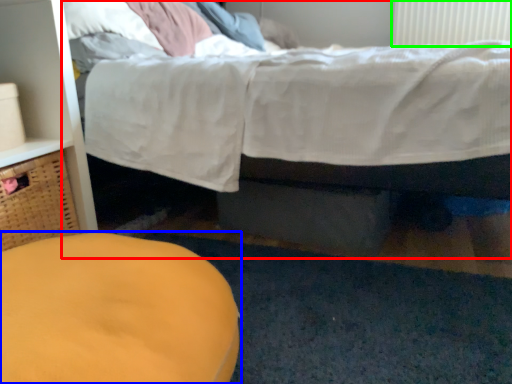
Question: Which object is the farthest from bed (highlighted by a red box)? Choose among these: furniture (highlighted by a blue box) or radiator (highlighted by a green box).

Choices:
 (A) furniture
 (B) radiator

Answer: (B)